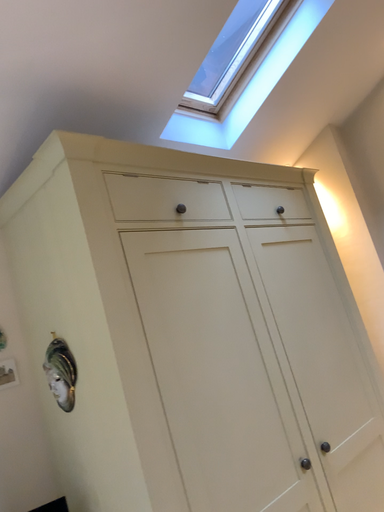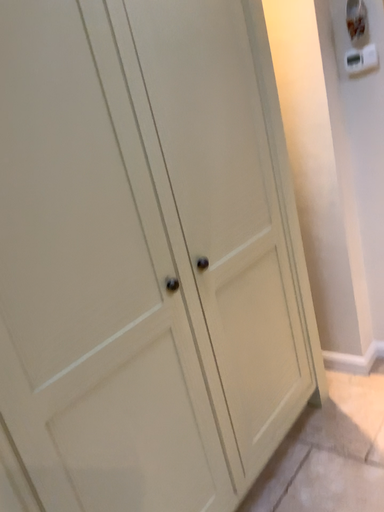
Question: How did the camera likely rotate when shooting the video?

Choices:
 (A) rotated left
 (B) rotated right

Answer: (B)